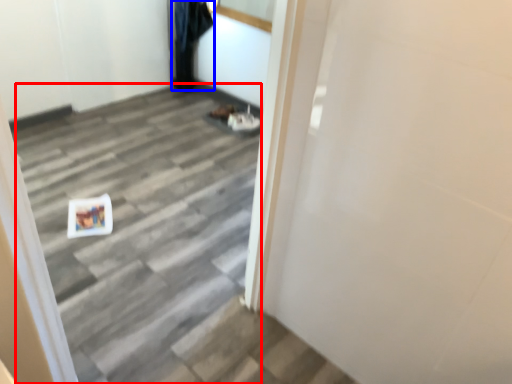
Question: Which object appears farthest to the camera in this image, stairwell (highlighted by a red box) or garment (highlighted by a blue box)?

Choices:
 (A) stairwell
 (B) garment

Answer: (B)